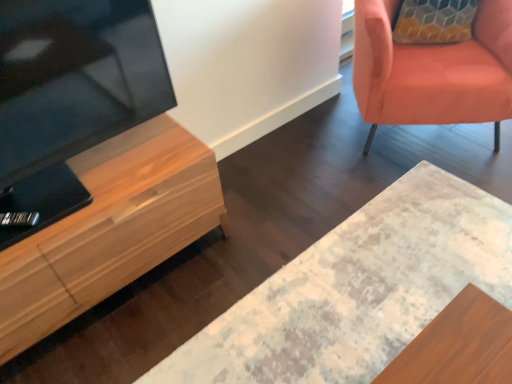
Question: Would you say light wood cabinet at left is inside or outside matte orange chair at upper right?

Choices:
 (A) inside
 (B) outside

Answer: (B)

Question: Considering their positions, is light wood cabinet at left located in front of or behind matte orange chair at upper right?

Choices:
 (A) behind
 (B) front

Answer: (B)

Question: Considering the real-world distances, which object is farthest from the distressed wood desk at center?

Choices:
 (A) light wood cabinet at left
 (B) matte orange chair at upper right
 (C) matte wood television at left

Answer: (C)

Question: Which object is the closest to the matte orange chair at upper right?

Choices:
 (A) light wood cabinet at left
 (B) distressed wood desk at center
 (C) matte wood television at left

Answer: (B)